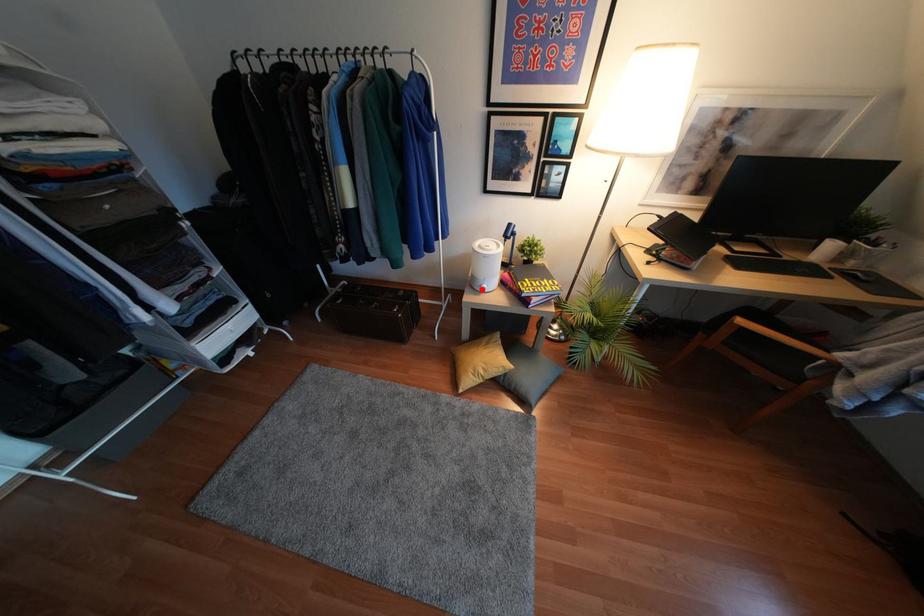
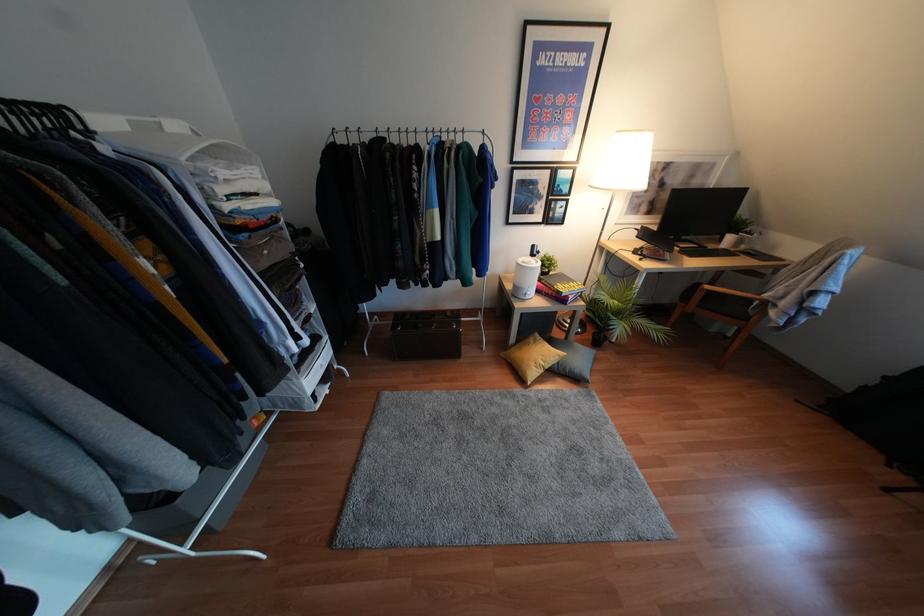
Where in the second image is the point corresponding to the highlighted location from the first image?

(526, 297)